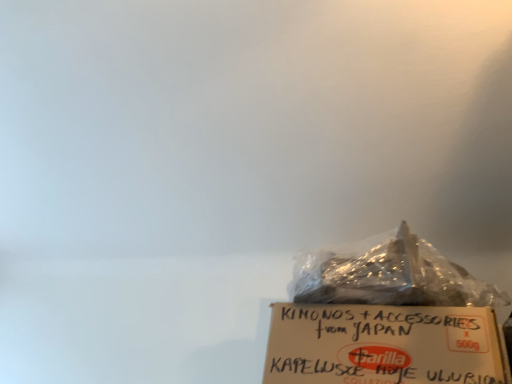
What is the approximate width of white cardboard sign at center?

The width of white cardboard sign at center is 13.28 inches.

At what (x,y) coordinates should I click in order to perform the action: click on white cardboard sign at center. Please return your answer as a coordinate pair (x, y). Image resolution: width=512 pixels, height=384 pixels. Looking at the image, I should click on (384, 345).

What do you see at coordinates (384, 345) in the screenshot?
I see `white cardboard sign at center` at bounding box center [384, 345].

Where is `white cardboard sign at center`? The image size is (512, 384). white cardboard sign at center is located at coordinates (384, 345).